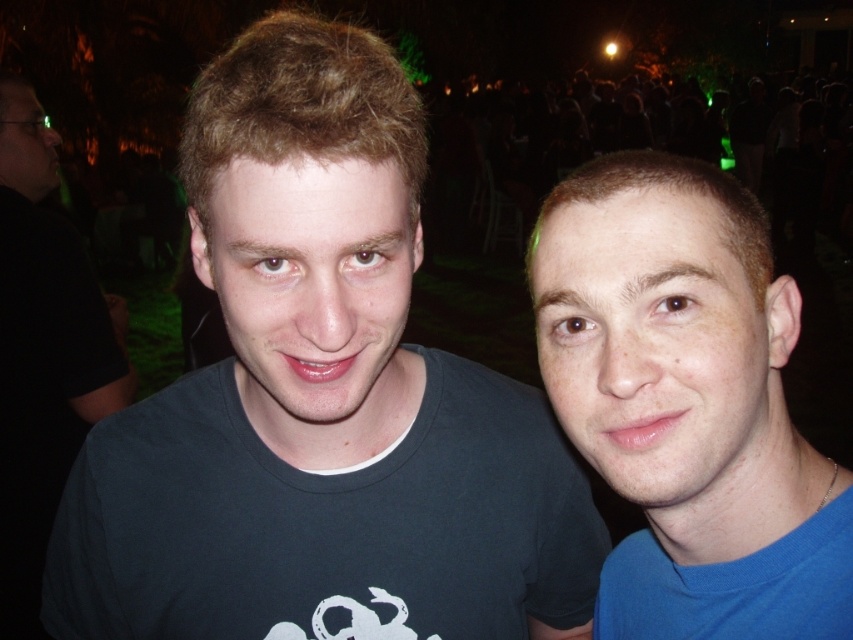
Question: Can you confirm if dark blue t-shirt at center is positioned above black matte t-shirt at left?

Choices:
 (A) yes
 (B) no

Answer: (B)

Question: Is the position of blue matte shirt at right less distant than that of black matte t-shirt at left?

Choices:
 (A) no
 (B) yes

Answer: (B)

Question: Considering the relative positions of dark blue t-shirt at center and black matte t-shirt at left in the image provided, where is dark blue t-shirt at center located with respect to black matte t-shirt at left?

Choices:
 (A) above
 (B) below

Answer: (B)

Question: Which is farther from the dark blue t-shirt at center?

Choices:
 (A) black matte t-shirt at left
 (B) blue matte shirt at right

Answer: (A)

Question: Which point is farther from the camera taking this photo?

Choices:
 (A) (117, 348)
 (B) (564, 424)
 (C) (346, 60)

Answer: (A)

Question: Estimate the real-world distances between objects in this image. Which object is farther from the dark blue t-shirt at center?

Choices:
 (A) blue matte shirt at right
 (B) black matte t-shirt at left

Answer: (B)